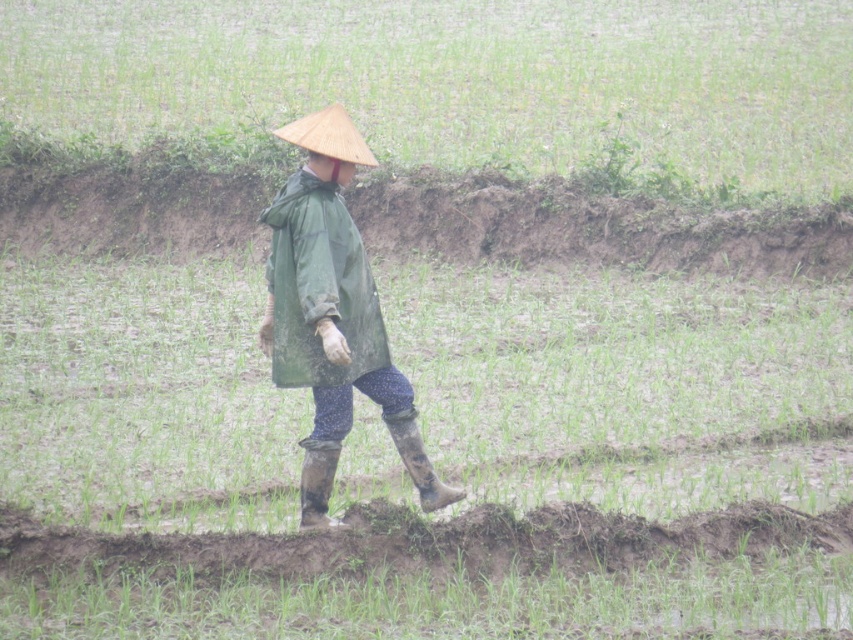
Question: Is green matte field at center wider than brown muddy soil at center?

Choices:
 (A) no
 (B) yes

Answer: (B)

Question: Estimate the real-world distances between objects in this image. Which object is closer to the green matte field at center?

Choices:
 (A) rubber/muddy boot at lower center
 (B) green matte raincoat at center

Answer: (A)

Question: Does green matte raincoat at center appear on the right side of rubber/muddy boot at lower center?

Choices:
 (A) no
 (B) yes

Answer: (A)

Question: Does brown muddy soil at center have a greater width compared to rubber/muddy boot at lower center?

Choices:
 (A) yes
 (B) no

Answer: (A)

Question: Which point is farther from the camera taking this photo?

Choices:
 (A) (416, 474)
 (B) (848, 515)
 (C) (369, 397)
 (D) (312, 492)

Answer: (B)

Question: Estimate the real-world distances between objects in this image. Which object is closer to the green matte raincoat at center?

Choices:
 (A) brown muddy soil at center
 (B) green matte field at center
 (C) rubber/muddy boot at lower center
 (D) rubber/muddy boot at center

Answer: (C)